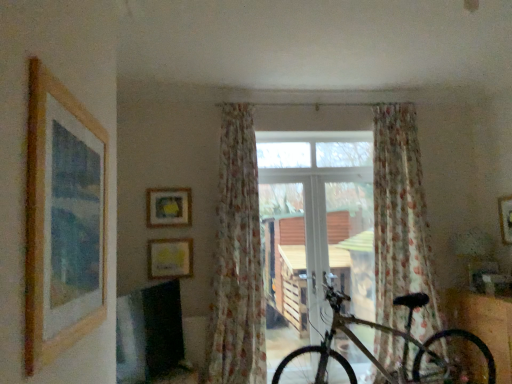
Question: Does metallic silver bicycle at lower right have a greater height compared to wooden picture frame at left, placed as the 3th picture frame when sorted from left to right?

Choices:
 (A) no
 (B) yes

Answer: (B)

Question: Are metallic silver bicycle at lower right and wooden picture frame at left, placed as the 3th picture frame when sorted from left to right, located far from each other?

Choices:
 (A) no
 (B) yes

Answer: (B)

Question: Is the position of metallic silver bicycle at lower right less distant than that of wooden picture frame at left, which is the fourth picture frame in back-to-front order?

Choices:
 (A) yes
 (B) no

Answer: (B)

Question: Is metallic silver bicycle at lower right oriented towards wooden picture frame at left, which is the 1th picture frame from front to back?

Choices:
 (A) yes
 (B) no

Answer: (B)

Question: Can you confirm if metallic silver bicycle at lower right is bigger than wooden picture frame at left, placed as the 3th picture frame when sorted from left to right?

Choices:
 (A) yes
 (B) no

Answer: (A)

Question: Considering the positions of point (147, 251) and point (244, 195), is point (147, 251) closer or farther from the camera than point (244, 195)?

Choices:
 (A) closer
 (B) farther

Answer: (B)

Question: Considering the positions of yellow paper at upper center, which is counted as the second picture frame, starting from the left, and floral sheer curtain at center, which is the 1th curtain from left to right, in the image, is yellow paper at upper center, which is counted as the second picture frame, starting from the left, wider or thinner than floral sheer curtain at center, which is the 1th curtain from left to right,?

Choices:
 (A) thin
 (B) wide

Answer: (A)

Question: From a real-world perspective, relative to floral sheer curtain at center, the 2th curtain when ordered from right to left, is yellow paper at upper center, the 3th picture frame in the front-to-back sequence, vertically above or below?

Choices:
 (A) below
 (B) above

Answer: (A)

Question: Considering the positions of yellow paper at upper center, the 3th picture frame in the front-to-back sequence, and floral sheer curtain at center, which is the 1th curtain from left to right, in the image, is yellow paper at upper center, the 3th picture frame in the front-to-back sequence, taller or shorter than floral sheer curtain at center, which is the 1th curtain from left to right,?

Choices:
 (A) tall
 (B) short

Answer: (B)

Question: Is point (353, 167) closer or farther from the camera than point (95, 127)?

Choices:
 (A) closer
 (B) farther

Answer: (B)

Question: From the image's perspective, is white plastic window at center above or below wooden picture frame at left, which is the 1th picture frame from front to back?

Choices:
 (A) below
 (B) above

Answer: (A)

Question: From a real-world perspective, is white plastic window at center positioned above or below wooden picture frame at left, which is the fourth picture frame in back-to-front order?

Choices:
 (A) above
 (B) below

Answer: (B)

Question: Is white plastic window at center wider or thinner than wooden picture frame at left, placed as the 3th picture frame when sorted from left to right?

Choices:
 (A) wide
 (B) thin

Answer: (A)

Question: Is floral sheer curtain at center, which is the 2th curtain from left to right, wider or thinner than white plastic window at center?

Choices:
 (A) thin
 (B) wide

Answer: (B)

Question: Is floral sheer curtain at center, which is the 2th curtain from left to right, to the left or to the right of white plastic window at center in the image?

Choices:
 (A) left
 (B) right

Answer: (B)